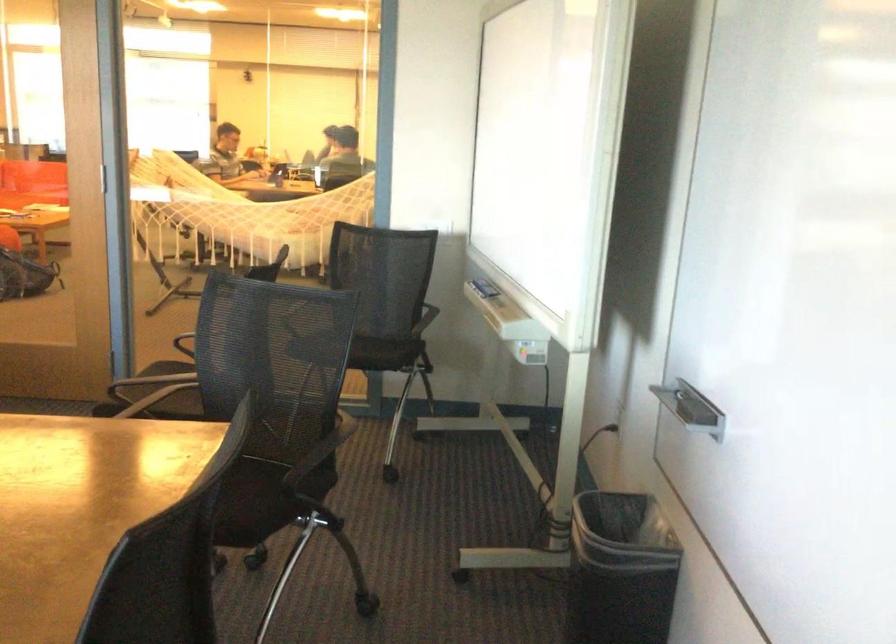
Locate an element on the screen. Image resolution: width=896 pixels, height=644 pixels. silver door handle is located at coordinates (691, 408).